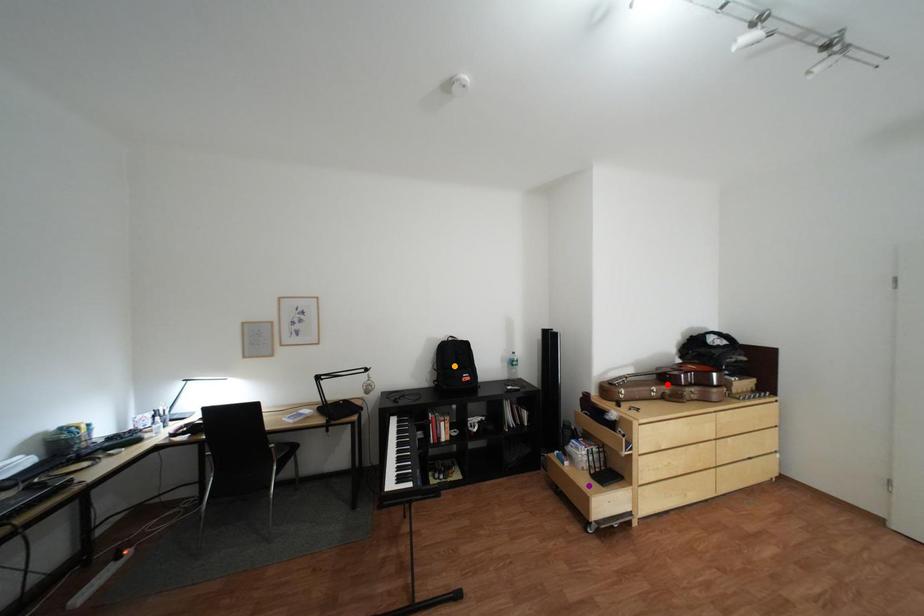
Order these from nearest to farthest:
red point | purple point | orange point

purple point → red point → orange point